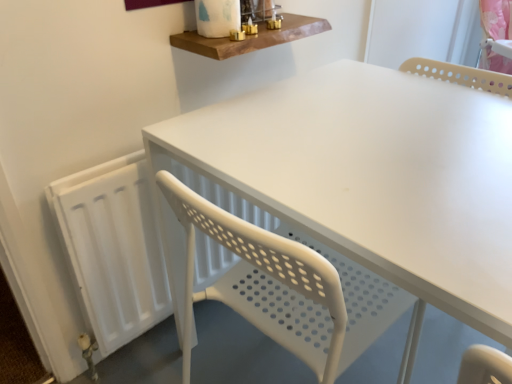
Question: Considering the positions of white matte table at center and white matte radiator at left in the image, is white matte table at center bigger or smaller than white matte radiator at left?

Choices:
 (A) big
 (B) small

Answer: (A)

Question: Is white matte table at center taller or shorter than white matte radiator at left?

Choices:
 (A) short
 (B) tall

Answer: (B)

Question: Which object is positioned farthest from the white matte table at center?

Choices:
 (A) wooden shelf at upper center
 (B) white matte radiator at left

Answer: (B)

Question: Estimate the real-world distances between objects in this image. Which object is closer to the white matte table at center?

Choices:
 (A) wooden shelf at upper center
 (B) white matte radiator at left

Answer: (A)